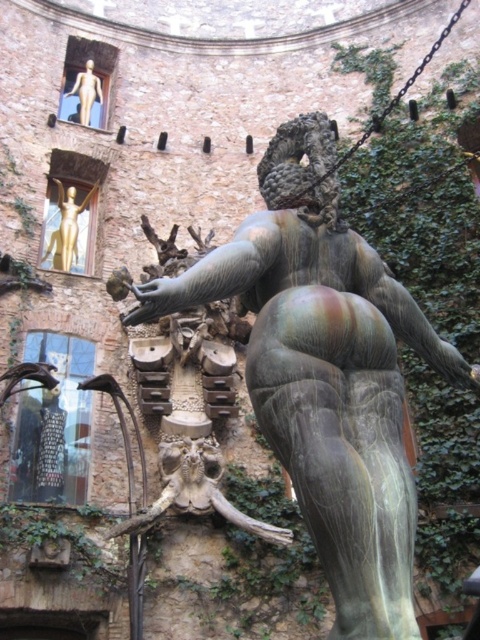
In the scene shown: Who is more forward, (48, 227) or (90, 113)?

Point (48, 227) is in front.

Can you confirm if gold metallic statue at upper left is positioned to the left of matte gold statue at upper left?

In fact, gold metallic statue at upper left is to the right of matte gold statue at upper left.

Between point (62, 184) and point (92, 100), which one is positioned in front?

Point (62, 184)

Locate an element on the screen. The image size is (480, 640). gold metallic statue at upper left is located at coordinates (67, 225).

Does bronze statue at center appear over gold metallic statue at upper left?

Actually, bronze statue at center is below gold metallic statue at upper left.

Does bronze statue at center lie in front of gold metallic statue at upper left?

Yes, bronze statue at center is in front of gold metallic statue at upper left.

Between point (254, 230) and point (51, 253), which one is positioned behind?

Point (51, 253)

Find the location of a particular element. This screenshot has width=480, height=640. bronze statue at center is located at coordinates (325, 372).

Looking at this image, can you confirm if bronze statue at center is smaller than matte gold statue at upper left?

Incorrect, bronze statue at center is not smaller in size than matte gold statue at upper left.

Which is behind, point (342, 448) or point (96, 90)?

Positioned behind is point (96, 90).

Which is in front, point (311, 380) or point (81, 116)?

Positioned in front is point (311, 380).

Identify the location of bronze statue at center. This screenshot has height=640, width=480. (325, 372).